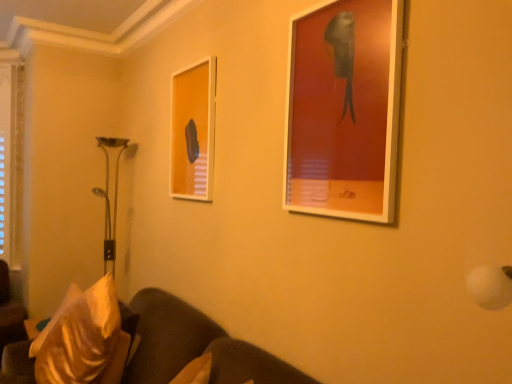
Question: From a real-world perspective, is suede-like brown couch at lower left physically located above or below velvet gold pillow at lower left?

Choices:
 (A) above
 (B) below

Answer: (B)

Question: Considering the positions of point (296, 379) and point (33, 367), is point (296, 379) closer or farther from the camera than point (33, 367)?

Choices:
 (A) closer
 (B) farther

Answer: (A)

Question: Estimate the real-world distances between objects in this image. Which object is farther from the velvet gold pillow at lower left?

Choices:
 (A) matte white picture frame at upper right, the 2th picture frame in the back-to-front sequence
 (B) metallic gold table lamp at left
 (C) matte glass picture frame at center, which is counted as the second picture frame, starting from the front
 (D) suede-like brown couch at lower left

Answer: (B)

Question: Which of these objects is positioned closest to the matte white picture frame at upper right, arranged as the first picture frame when viewed from the right?

Choices:
 (A) suede-like brown couch at lower left
 (B) metallic gold table lamp at left
 (C) matte glass picture frame at center, marked as the 1th picture frame in a left-to-right arrangement
 (D) velvet gold pillow at lower left

Answer: (C)